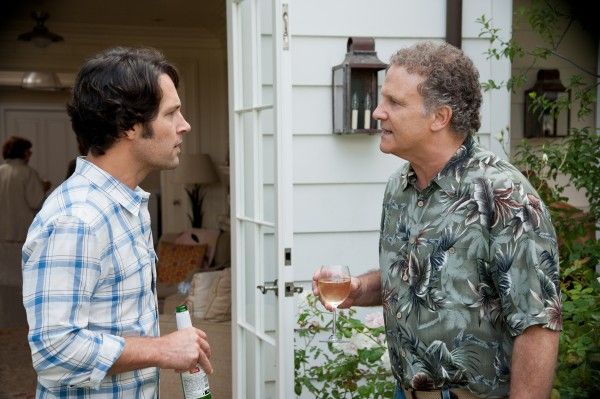
Where is `white door inside of house`? The width and height of the screenshot is (600, 399). white door inside of house is located at coordinates (53, 153).